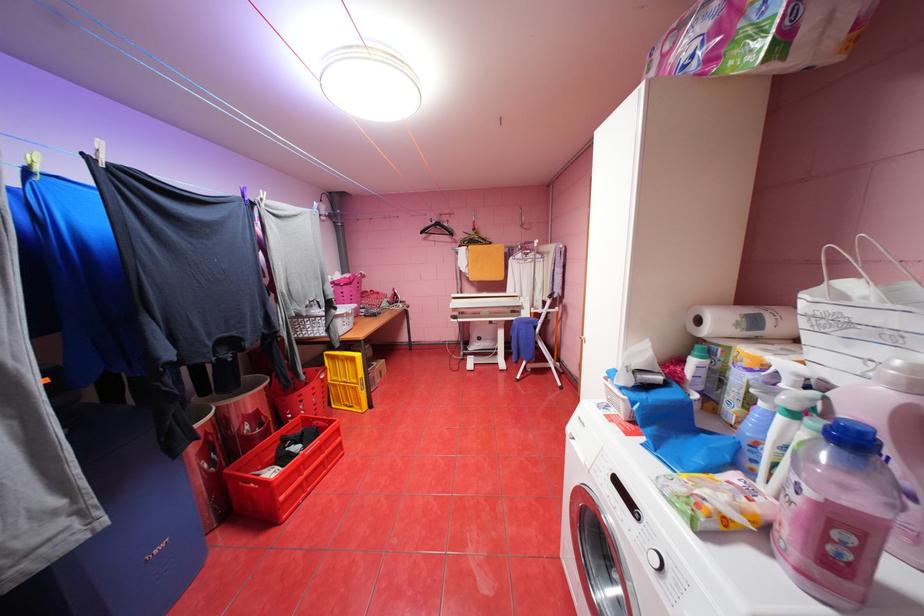
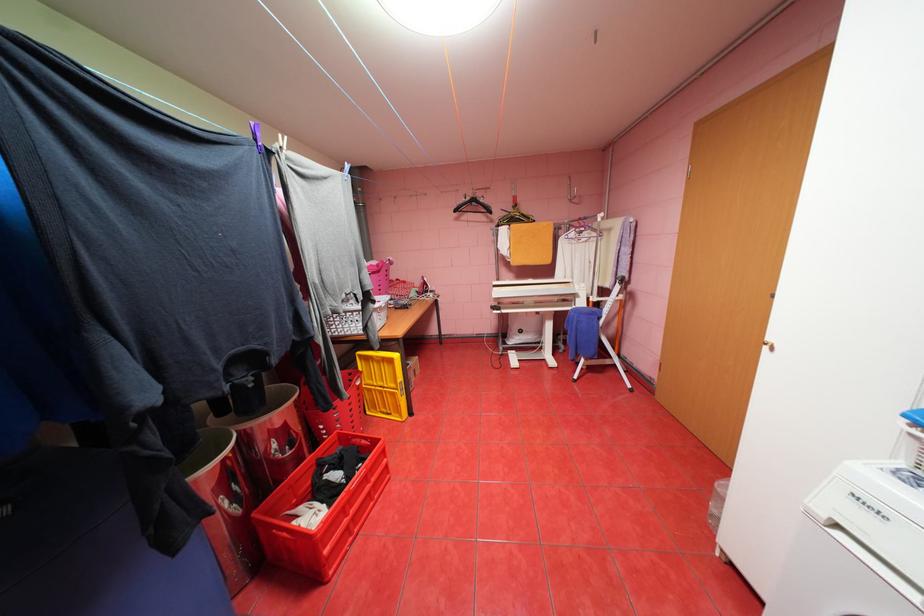
In the second image, find the point that corresponds to [314,421] in the first image.

(351, 438)